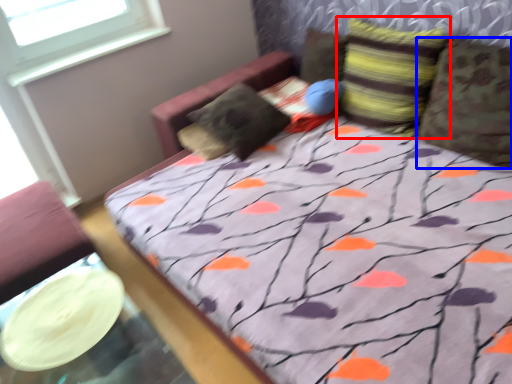
Question: Which object appears closest to the camera in this image, pillow (highlighted by a red box) or pillow (highlighted by a blue box)?

Choices:
 (A) pillow
 (B) pillow

Answer: (B)